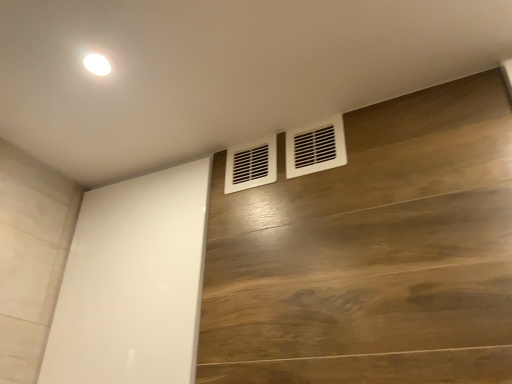
Question: Considering the relative sizes of white matte vent at center, arranged as the first air conditioning when viewed from the left, and white plastic vent at upper right, which is counted as the second air conditioning, starting from the left, in the image provided, is white matte vent at center, arranged as the first air conditioning when viewed from the left, shorter than white plastic vent at upper right, which is counted as the second air conditioning, starting from the left,?

Choices:
 (A) no
 (B) yes

Answer: (B)

Question: Is the depth of white matte vent at center, arranged as the first air conditioning when viewed from the left, less than that of white plastic vent at upper right, which is counted as the second air conditioning, starting from the left?

Choices:
 (A) no
 (B) yes

Answer: (A)

Question: Can you confirm if white matte vent at center, the second air conditioning viewed from the right, is taller than white plastic vent at upper right, the first air conditioning when ordered from right to left?

Choices:
 (A) yes
 (B) no

Answer: (B)

Question: From a real-world perspective, is white matte vent at center, arranged as the first air conditioning when viewed from the left, physically above white plastic vent at upper right, which is counted as the second air conditioning, starting from the left?

Choices:
 (A) yes
 (B) no

Answer: (A)

Question: Is white matte vent at center, arranged as the first air conditioning when viewed from the left, next to white plastic vent at upper right, which is counted as the second air conditioning, starting from the left, and touching it?

Choices:
 (A) yes
 (B) no

Answer: (B)

Question: Considering their positions, is white matte vent at center, arranged as the first air conditioning when viewed from the left, located in front of or behind white glossy screen door at center?

Choices:
 (A) behind
 (B) front

Answer: (A)

Question: Is white matte vent at center, the second air conditioning viewed from the right, wider or thinner than white glossy screen door at center?

Choices:
 (A) wide
 (B) thin

Answer: (B)

Question: In terms of size, does white matte vent at center, the second air conditioning viewed from the right, appear bigger or smaller than white glossy screen door at center?

Choices:
 (A) small
 (B) big

Answer: (A)

Question: From a real-world perspective, is white matte vent at center, the second air conditioning viewed from the right, positioned above or below white glossy screen door at center?

Choices:
 (A) above
 (B) below

Answer: (A)

Question: Is white glossy screen door at center bigger or smaller than white matte vent at center, arranged as the first air conditioning when viewed from the left?

Choices:
 (A) big
 (B) small

Answer: (A)

Question: Considering the positions of point (79, 349) and point (260, 140), is point (79, 349) closer or farther from the camera than point (260, 140)?

Choices:
 (A) closer
 (B) farther

Answer: (A)

Question: Would you say white glossy screen door at center is to the left or to the right of white matte vent at center, the second air conditioning viewed from the right, in the picture?

Choices:
 (A) left
 (B) right

Answer: (A)

Question: From the image's perspective, is white glossy screen door at center positioned above or below white matte vent at center, arranged as the first air conditioning when viewed from the left?

Choices:
 (A) below
 (B) above

Answer: (A)

Question: From a real-world perspective, is white plastic vent at upper right, the first air conditioning when ordered from right to left, above or below white matte vent at center, arranged as the first air conditioning when viewed from the left?

Choices:
 (A) above
 (B) below

Answer: (B)

Question: From their relative heights in the image, would you say white plastic vent at upper right, which is counted as the second air conditioning, starting from the left, is taller or shorter than white matte vent at center, arranged as the first air conditioning when viewed from the left?

Choices:
 (A) tall
 (B) short

Answer: (A)